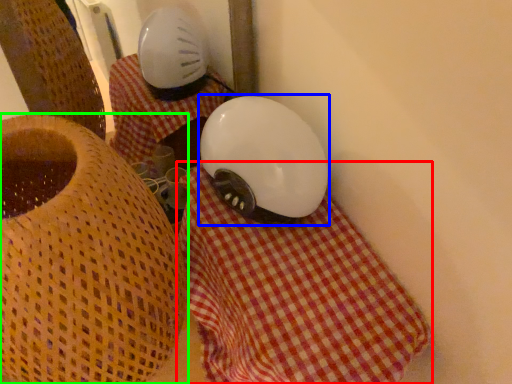
Question: Based on their relative distances, which object is nearer to blanket (highlighted by a red box)? Choose from helmet (highlighted by a blue box) and furniture (highlighted by a green box).

Choices:
 (A) helmet
 (B) furniture

Answer: (A)